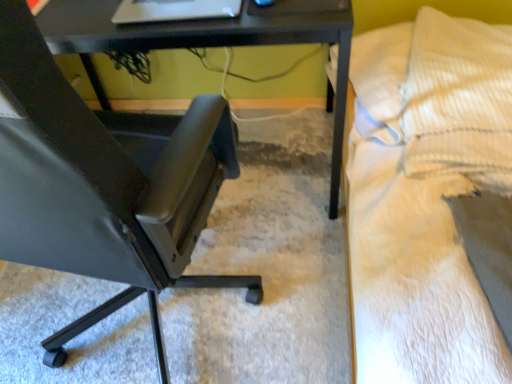
Question: Is white textured bed at right far away from matte black chair at left?

Choices:
 (A) yes
 (B) no

Answer: (B)

Question: Considering the relative sizes of white textured bed at right and matte black chair at left in the image provided, is white textured bed at right thinner than matte black chair at left?

Choices:
 (A) yes
 (B) no

Answer: (B)

Question: From the image's perspective, is white textured bed at right over matte black chair at left?

Choices:
 (A) no
 (B) yes

Answer: (B)

Question: Is white textured bed at right positioned before matte black chair at left?

Choices:
 (A) no
 (B) yes

Answer: (A)

Question: Does white textured bed at right have a greater width compared to matte black chair at left?

Choices:
 (A) no
 (B) yes

Answer: (B)

Question: From a real-world perspective, is yellow corduroy pillow at upper right physically located above or below matte black chair at left?

Choices:
 (A) below
 (B) above

Answer: (A)

Question: Looking at the image, does yellow corduroy pillow at upper right seem bigger or smaller compared to matte black chair at left?

Choices:
 (A) big
 (B) small

Answer: (B)

Question: From the image's perspective, is yellow corduroy pillow at upper right above or below matte black chair at left?

Choices:
 (A) above
 (B) below

Answer: (A)

Question: Does point (476, 23) appear closer or farther from the camera than point (175, 210)?

Choices:
 (A) closer
 (B) farther

Answer: (B)

Question: Considering the positions of black plastic table at center and matte black chair at left in the image, is black plastic table at center bigger or smaller than matte black chair at left?

Choices:
 (A) big
 (B) small

Answer: (A)

Question: Choose the correct answer: Is black plastic table at center inside matte black chair at left or outside it?

Choices:
 (A) inside
 (B) outside

Answer: (B)

Question: Considering the positions of black plastic table at center and matte black chair at left in the image, is black plastic table at center taller or shorter than matte black chair at left?

Choices:
 (A) short
 (B) tall

Answer: (A)

Question: In the image, is black plastic table at center on the left side or the right side of matte black chair at left?

Choices:
 (A) left
 (B) right

Answer: (B)

Question: Relative to yellow corduroy pillow at upper right, is matte black chair at left in front or behind?

Choices:
 (A) front
 (B) behind

Answer: (A)

Question: From a real-world perspective, is matte black chair at left above or below yellow corduroy pillow at upper right?

Choices:
 (A) above
 (B) below

Answer: (A)